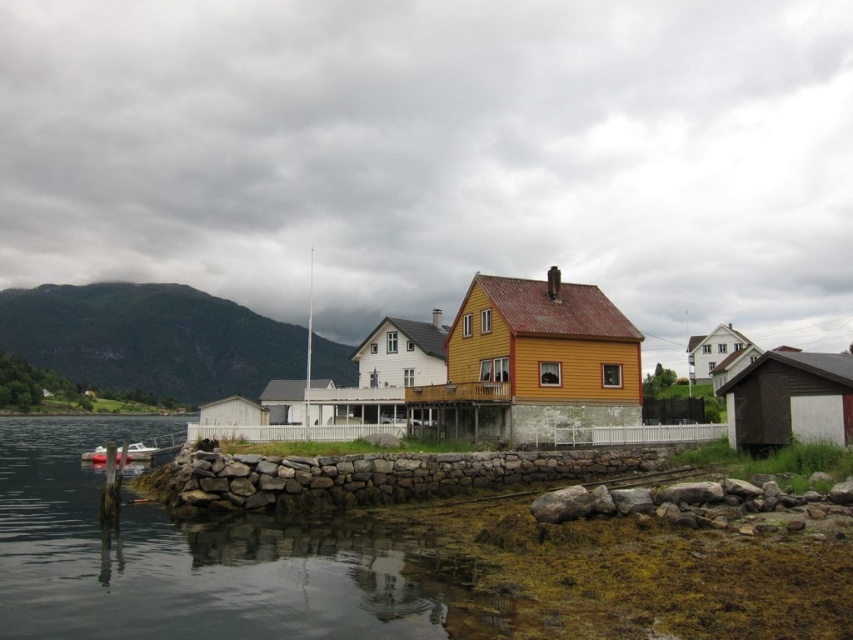
You are standing on the rocky shoreline and want to place a small toy boat into the water. The clear water at lower left and the white plastic boat at lower left are both in your view. Which object is shorter in height?

The clear water at lower left is shorter than the white plastic boat at lower left.

You are standing on the rocky shoreline and see the clear water at lower left and the white plastic boat at lower left. Which object appears larger in the image?

The white plastic boat at lower left appears larger because the clear water at lower left has a smaller size compared to it.

You are standing at the center of the image and want to reach the clear water at lower left. Which direction should you move towards?

You should move towards the lower left direction to reach the clear water at lower left.